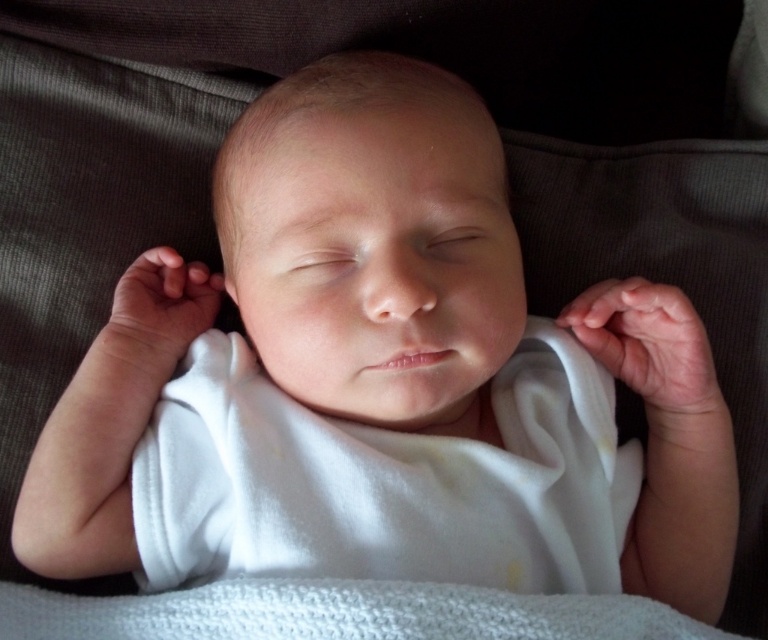
You are a photographer taking a picture of the smooth white baby at center and the white knitted blanket at center. To ensure the blanket is in focus, where should you adjust the camera focus relative to the baby?

The white knitted blanket at center is behind the smooth white baby at center, so to focus on the blanket, you should adjust the camera focus behind the baby.

You are a photographer taking a closeup shot of the smooth white baby at center and the white knitted blanket at center. Which object should you focus on if you want to capture the one that is taller?

The smooth white baby at center is much taller than the white knitted blanket at center, so you should focus on the smooth white baby at center to capture the taller object.

You are holding a small toy and want to place it near the point marked at coordinates [482,145]. If the toy is 3 inches in diameter, will it fit within the area around the point without overlapping other objects?

The point at [482,145] is 24.52 inches away from the viewer, so placing a 3 inch diameter toy there would fit comfortably without overlapping other objects since there is sufficient space.